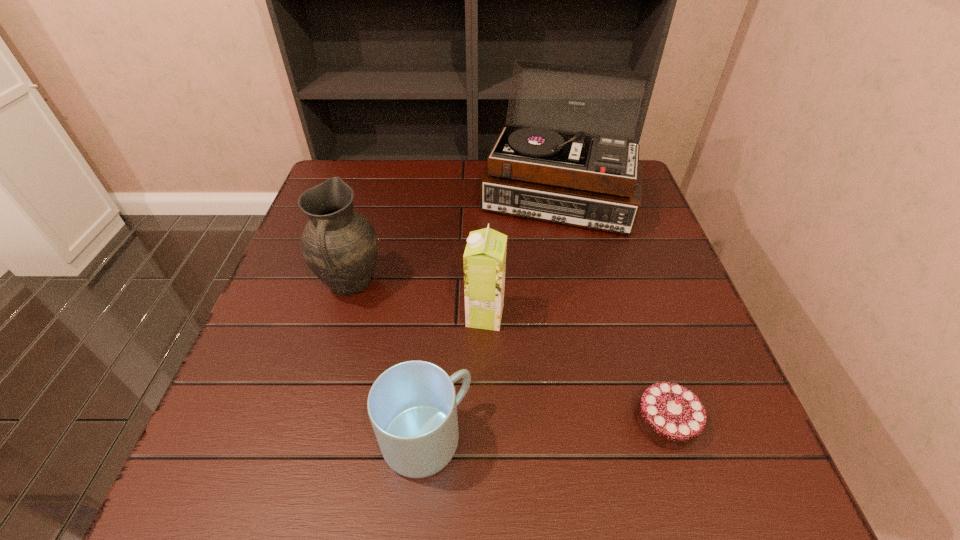
At what (x,y) coordinates should I click in order to perform the action: click on free region at the right edge of the desktop. Please return your answer as a coordinate pair (x, y). This screenshot has height=540, width=960. Looking at the image, I should click on (696, 393).

In the image, there is a desktop. Identify the location of vacant space at the far left corner. Image resolution: width=960 pixels, height=540 pixels. point(367,177).

Where is `vacant space that is in between the pitcher and the tallest object`? This screenshot has height=540, width=960. vacant space that is in between the pitcher and the tallest object is located at coordinates (454, 240).

Image resolution: width=960 pixels, height=540 pixels. I want to click on empty space that is in between the second shortest object and the leftmost object, so click(x=389, y=362).

I want to click on vacant region between the leftmost object and the shortest object, so click(509, 353).

Where is `unoccupied area between the chocolate cake and the leftmost object`? This screenshot has width=960, height=540. unoccupied area between the chocolate cake and the leftmost object is located at coordinates (509, 353).

The width and height of the screenshot is (960, 540). I want to click on vacant space in between the soya milk and the record player, so click(521, 255).

Locate an element on the screen. empty space that is in between the shortest object and the mug is located at coordinates (546, 430).

Find the location of a particular element. vacant area between the chocolate cake and the soya milk is located at coordinates (576, 369).

Select which object is the second closest to the leftmost object. Please provide its 2D coordinates. Your answer should be formatted as a tuple, i.e. [(x, y)], where the tuple contains the x and y coordinates of a point satisfying the conditions above.

[(412, 406)]